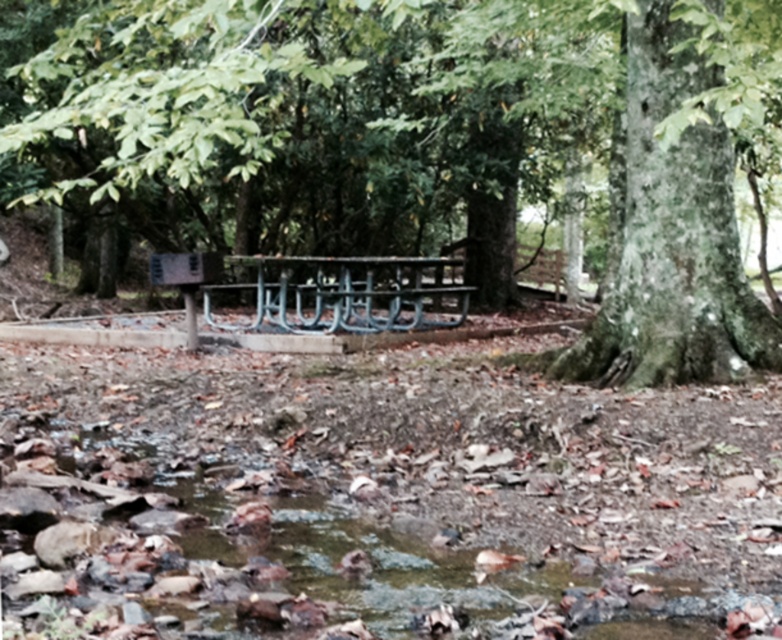
You are standing at the edge of the stream and want to reach the green rough bark tree at center. Which direction should you move relative to the clear water at center?

You should move to the right of the clear water at center to reach the green rough bark tree at center because the tree is positioned to the right of the water.

You are planning to take a photo of both the green rough bark tree at center and the green painted metal bench at center. Since you want them both in the frame, which object should you position closer to the camera to include both in the photo?

The green rough bark tree at center is to the left of the green painted metal bench at center, so you should position the camera closer to the tree to include both in the frame.